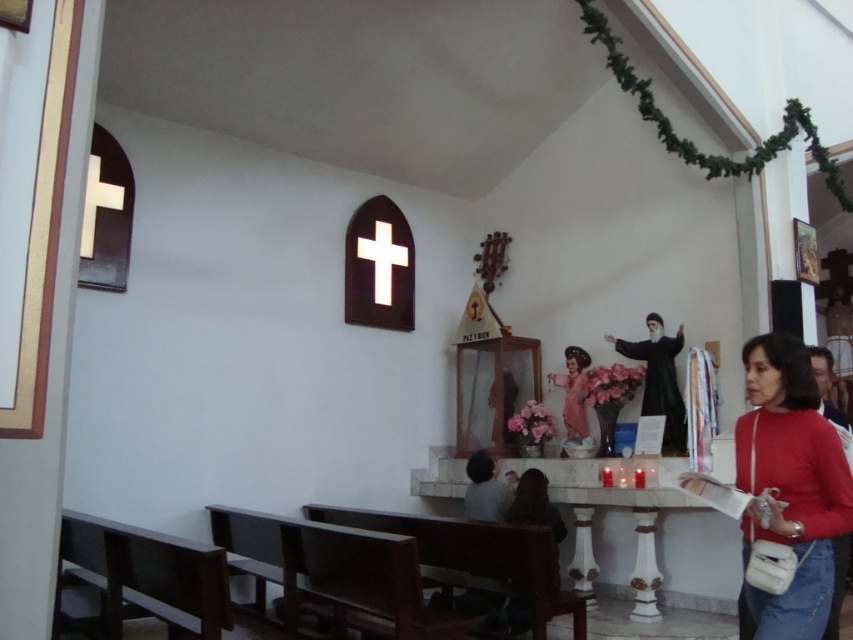
Question: Is dark brown wood church bench at lower left above white glossy cross at upper center?

Choices:
 (A) yes
 (B) no

Answer: (B)

Question: Does matte red sweater at lower right lie in front of brown wooden bench at lower center?

Choices:
 (A) no
 (B) yes

Answer: (B)

Question: Which point is farther to the camera?

Choices:
 (A) (788, 548)
 (B) (579, 381)
 (C) (254, 611)

Answer: (B)

Question: Which point is farther from the camera taking this photo?

Choices:
 (A) (566, 355)
 (B) (648, 360)
 (C) (529, 586)
 (D) (792, 525)

Answer: (A)

Question: Does dark brown wood church bench at lower left have a greater width compared to brown wooden bench at lower center?

Choices:
 (A) yes
 (B) no

Answer: (B)

Question: Which of the following is the farthest from the observer?

Choices:
 (A) (573, 378)
 (B) (583, 612)
 (C) (222, 538)
 (D) (383, 262)

Answer: (D)